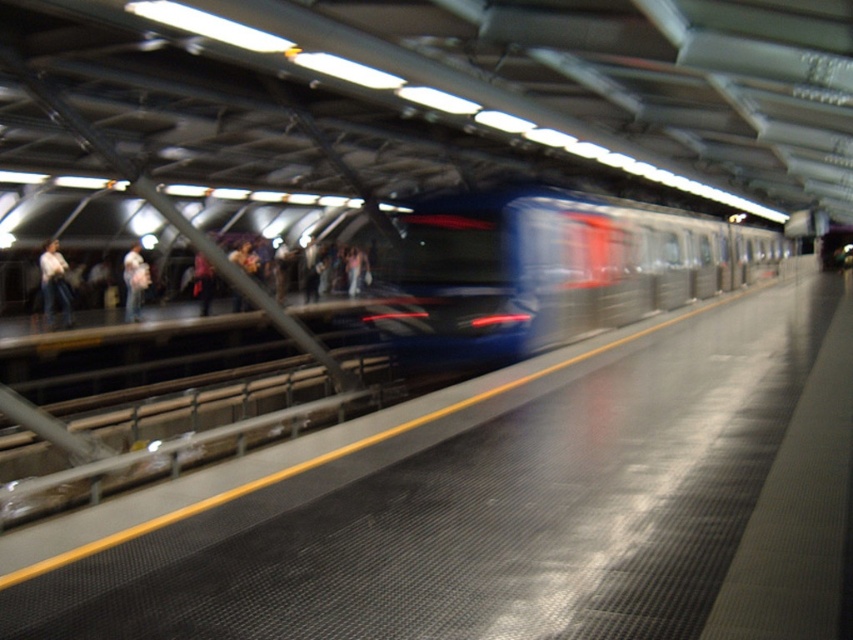
You are a passenger waiting on the subway platform and need to board the metallic blue train at center. The boarding area is 15 feet long. Can you reach the train before it passes your boarding area?

The metallic blue train at center and viewer are 34.19 feet apart from each other. Since the boarding area is only 15 feet long, the train is too far away to reach before it passes the boarding area.